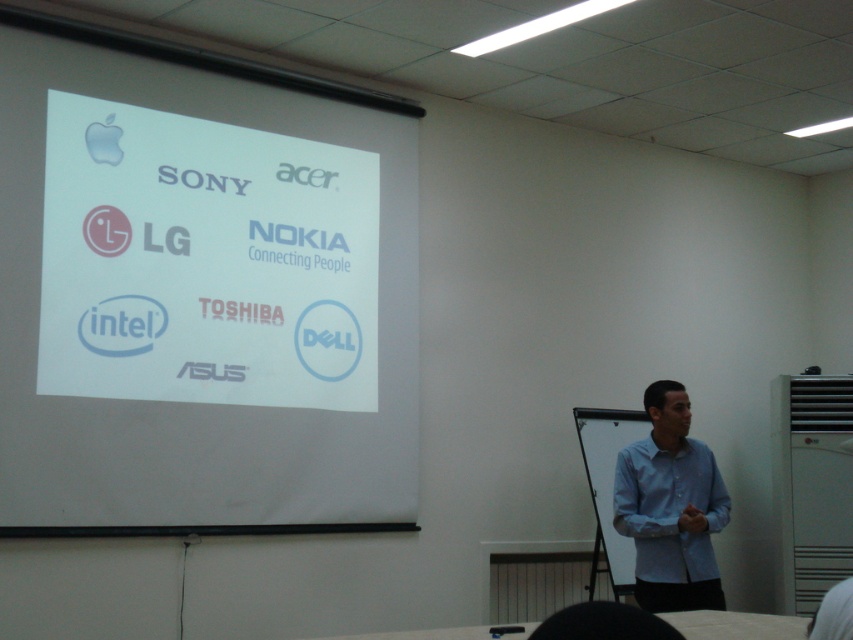
You are an attendee in the presentation and want to take notes on the flip chart. The flip chart has a white paper at upper left and a light blue cotton shirt at lower right. Which object is located to the left of the other?

The white paper at upper left is positioned on the left side of light blue cotton shirt at lower right.

You are attending a presentation and need to refer to the white paper at upper left and the light blue cotton shirt at lower right. Which object is positioned higher in the image?

The white paper at upper left is positioned higher than the light blue cotton shirt at lower right.